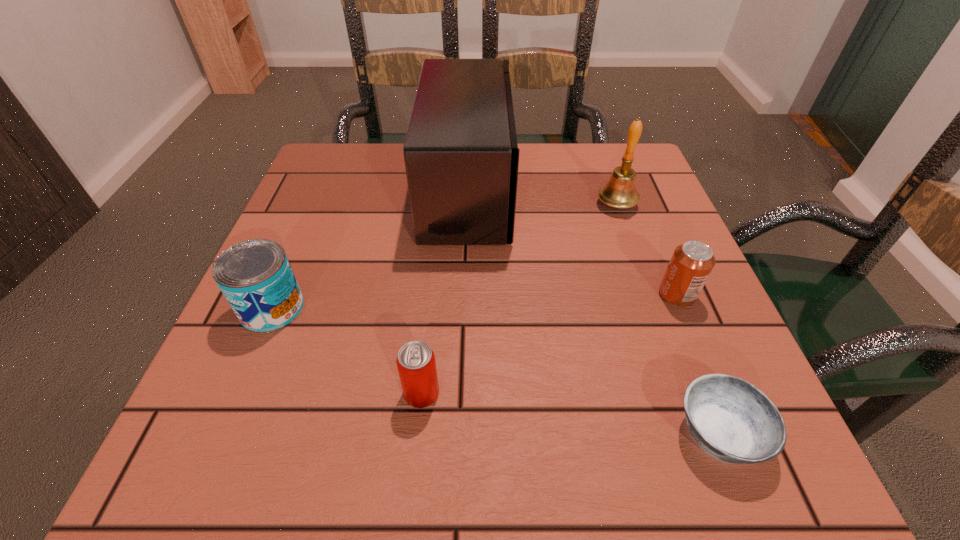
In order to click on vacant space located 0.270m on the left of the nearest can in this screenshot , I will do `click(221, 393)`.

Find the location of a particular element. free space located on the back of the ashtray is located at coordinates (644, 244).

Where is `microwave_oven that is at the far edge`? The width and height of the screenshot is (960, 540). microwave_oven that is at the far edge is located at coordinates (461, 156).

Locate an element on the screen. The width and height of the screenshot is (960, 540). bell present at the far edge is located at coordinates (619, 192).

Identify the location of object located at the near edge. (733, 421).

I want to click on object at the left edge, so click(255, 276).

Identify the location of bell located in the right edge section of the desktop. (619, 192).

Where is `can that is at the right edge`? Image resolution: width=960 pixels, height=540 pixels. can that is at the right edge is located at coordinates (692, 262).

Locate an element on the screen. ashtray that is at the right edge is located at coordinates (733, 421).

Where is `object that is at the far right corner`? This screenshot has width=960, height=540. object that is at the far right corner is located at coordinates (619, 192).